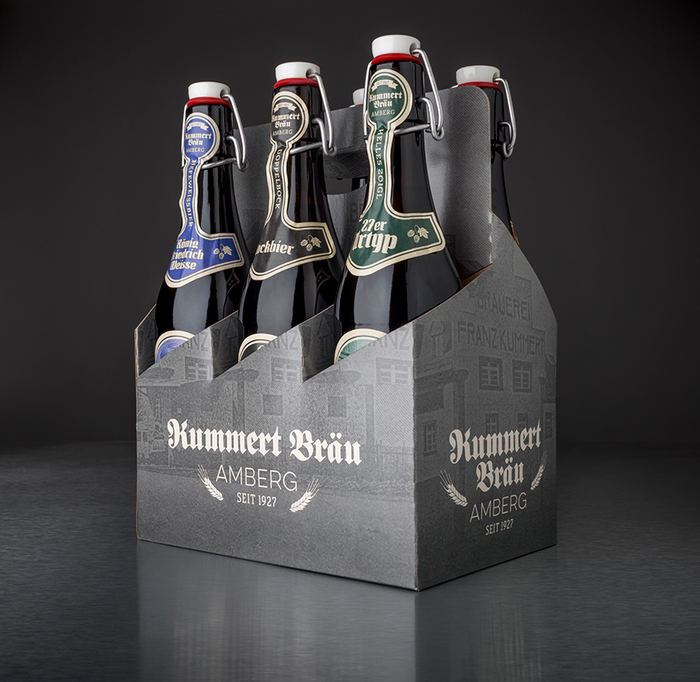
This screenshot has height=682, width=700. In order to click on rightmost bottle in this screenshot , I will do `click(498, 188)`.